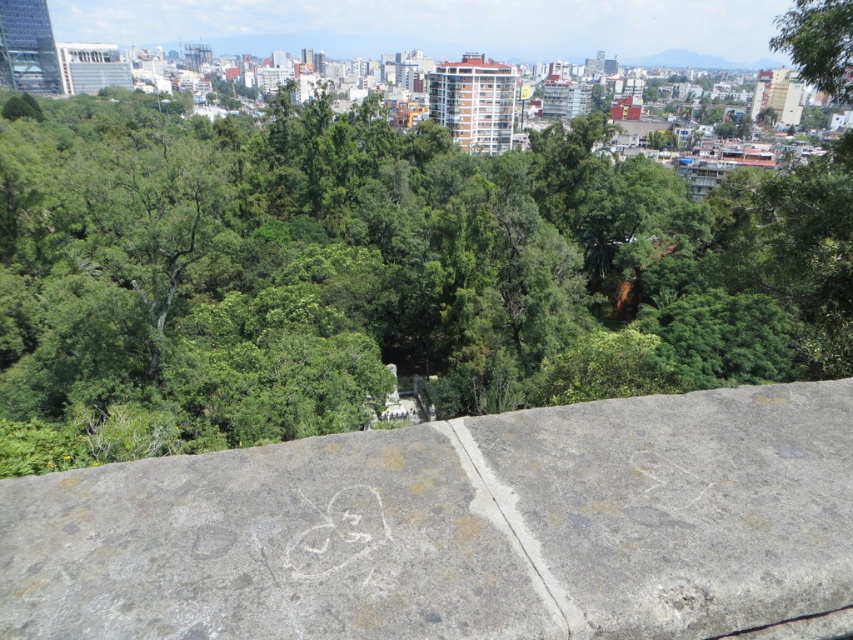
Can you confirm if green leafy tree at center is wider than gray concrete wall at center?

Yes.

Describe the element at coordinates (375, 273) in the screenshot. I see `green leafy tree at center` at that location.

Where is `green leafy tree at center`? green leafy tree at center is located at coordinates (375, 273).